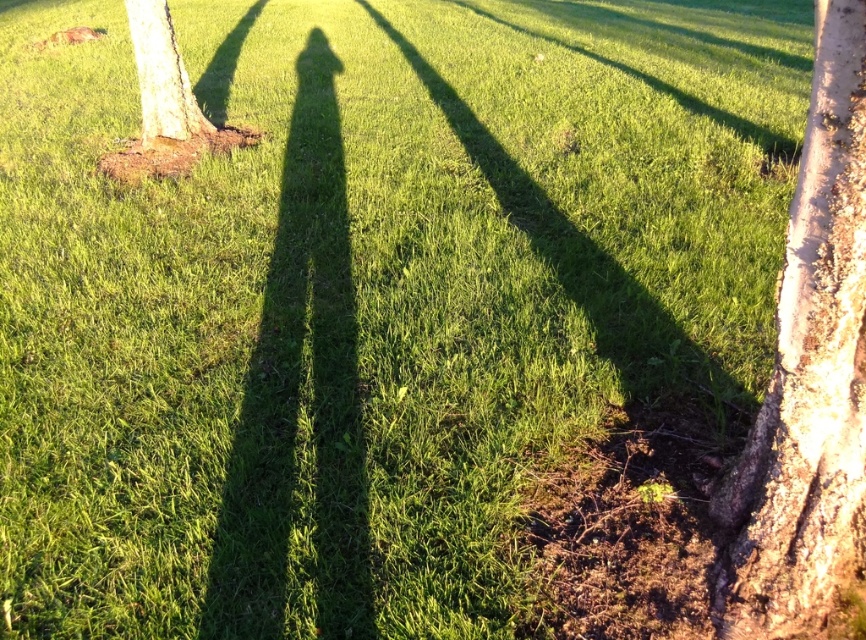
You are a park ranger assessing the trees in the image. Which tree trunk, the bark textured tree trunk at right or the smooth bark tree at left, would you expect to cast a longer shadow given their heights?

The bark textured tree trunk at right is much taller than the smooth bark tree at left, so it would cast a longer shadow.

You are planning to place a bench between the bark textured tree trunk at right and the smooth bark tree at left. Which tree trunk is narrower so that the bench can be placed closer to it?

The bark textured tree trunk at right has a lesser width compared to smooth bark tree at left, so the bench should be placed closer to the bark textured tree trunk at right.